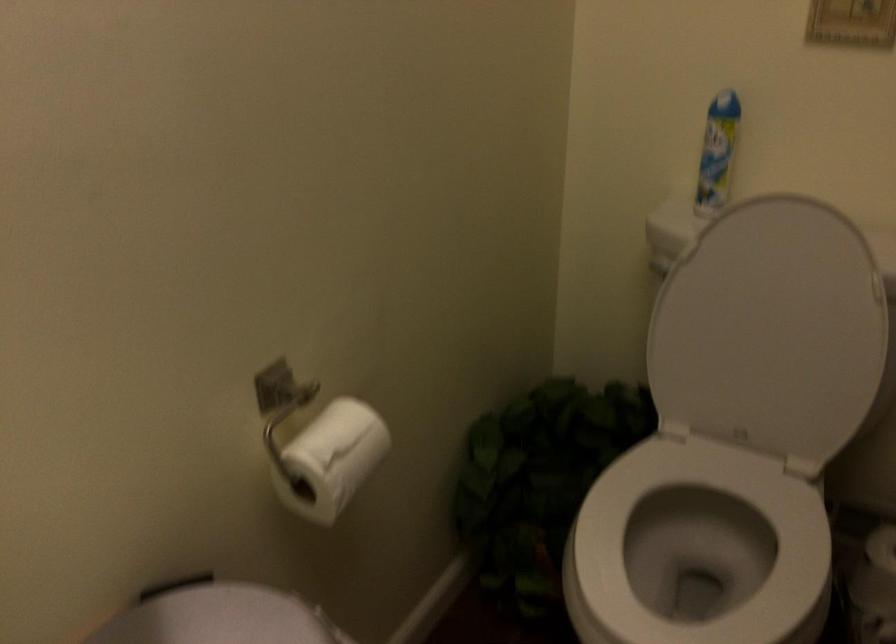
At what (x,y) coordinates should I click in order to perform the action: click on white toilet lid. Please return your answer as a coordinate pair (x, y). Looking at the image, I should click on (771, 330).